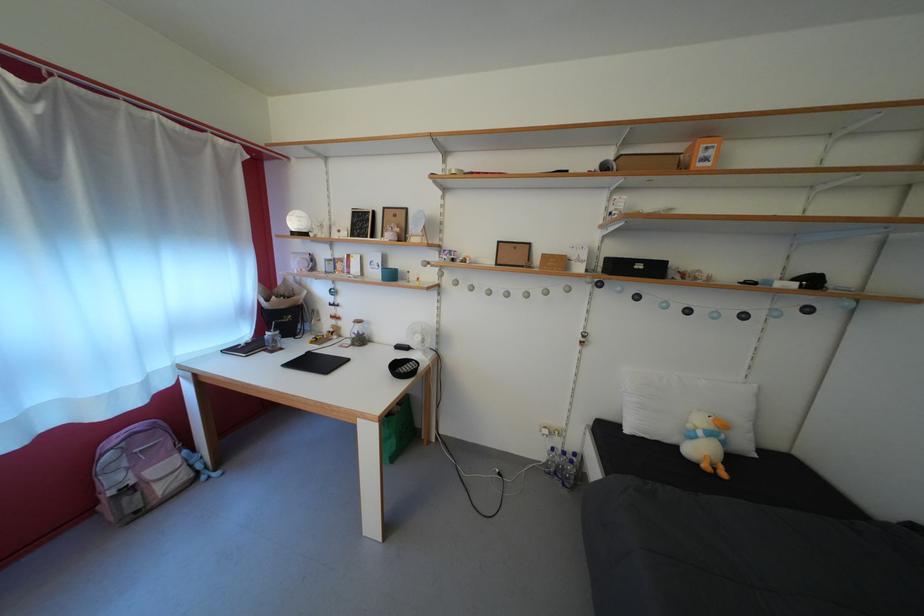
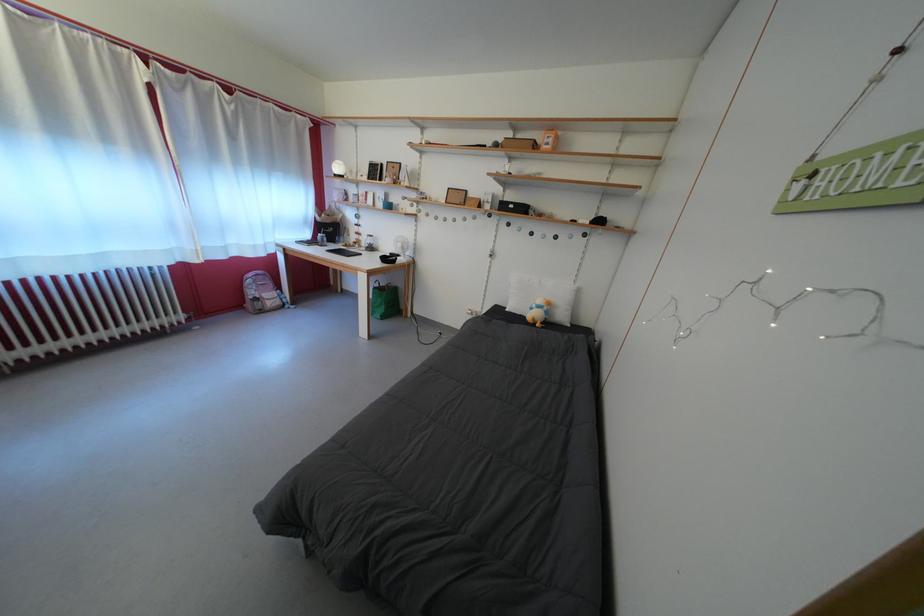
In the second image, find the point that corresponds to pixel 709 439 in the first image.

(542, 312)